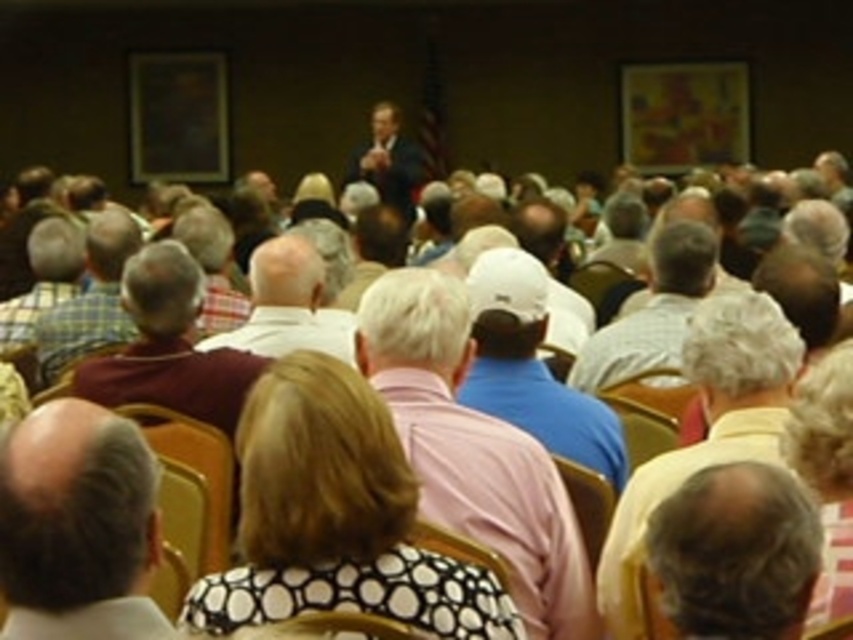
Is gray hair at lower right to the right of maroon shirt at center from the viewer's perspective?

Yes, gray hair at lower right is to the right of maroon shirt at center.

Find the location of `gray hair at lower right`. gray hair at lower right is located at coordinates (732, 554).

Is point (660, 502) behind point (200, 307)?

No.

Identify the location of gray hair at lower right. The width and height of the screenshot is (853, 640). (732, 554).

In the scene shown: Who is positioned more to the left, light brown hair at center or maroon shirt at center?

maroon shirt at center is more to the left.

Does light brown hair at center have a greater height compared to maroon shirt at center?

Yes.

In order to click on light brown hair at center in this screenshot , I will do `click(706, 429)`.

Between white matte baseball cap at center and wooden chair at center, which one is positioned higher?

Positioned higher is white matte baseball cap at center.

Is point (369, 380) more distant than point (596, 529)?

That is True.

Which is behind, point (509, 528) or point (583, 525)?

The point (583, 525) is more distant.

Locate an element on the screen. Image resolution: width=853 pixels, height=640 pixels. white matte baseball cap at center is located at coordinates (473, 449).